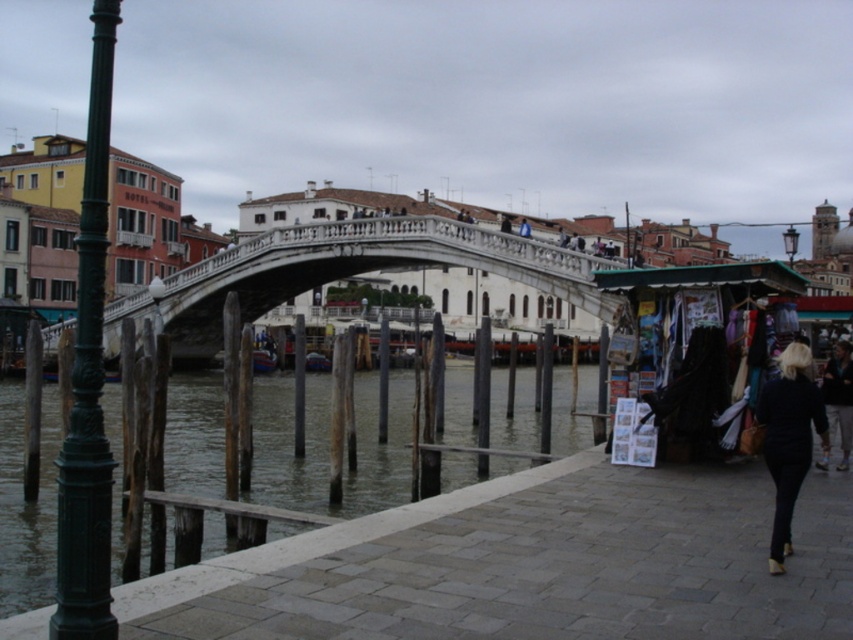
You are standing on the paved walkway near the green lamppost and want to reach the point marked by coordinates point [395,394] and point [788,454]. Which point is closer to you?

Point [395,394] is behind point [788,454], so point [788,454] is closer to you.

You are a tourist standing on the canal walkway and want to take a photo of the white stone bridge at center and the black leather jacket at lower right. Which object will appear larger in your photo?

The white stone bridge at center will appear larger in your photo because it is taller than the black leather jacket at lower right.